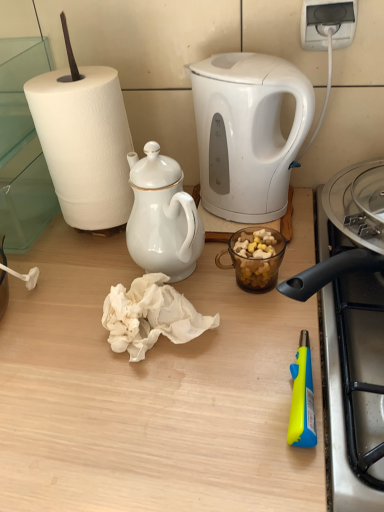
Where is `vacant region to the right of white crumpled paper towel at center`? The width and height of the screenshot is (384, 512). vacant region to the right of white crumpled paper towel at center is located at coordinates (259, 322).